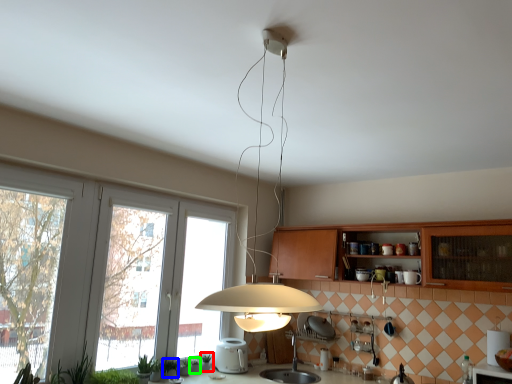
Question: Which is nearer to the plant (highlighted by a red box)? plant (highlighted by a blue box) or plant (highlighted by a green box).

Choices:
 (A) plant
 (B) plant

Answer: (B)